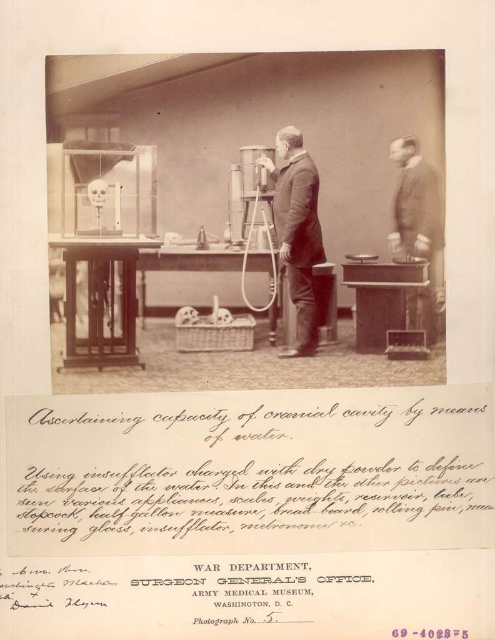
You are an archaeologist examining this historical laboratory image. You notice two points marked in the scene. Which of these two points, point (x=421, y=164) or point (x=374, y=260), is closer to you?

Point (x=421, y=164) is closer to the viewer than point (x=374, y=260).

You are a researcher in the lab and need to place both the smooth suit at center and the matte black box at center onto a shelf that can only hold items up to the size of the larger one. Which item should you place first to ensure both fit?

The smooth suit at center is larger in size than the matte black box at center. Therefore, place the smooth suit at center first to ensure both items fit on the shelf.

Based on the scene description, where is the smooth suit at center located?

The smooth suit at center is located at point coordinates of 0.362 on the x axis and 0.602 on the y axis.